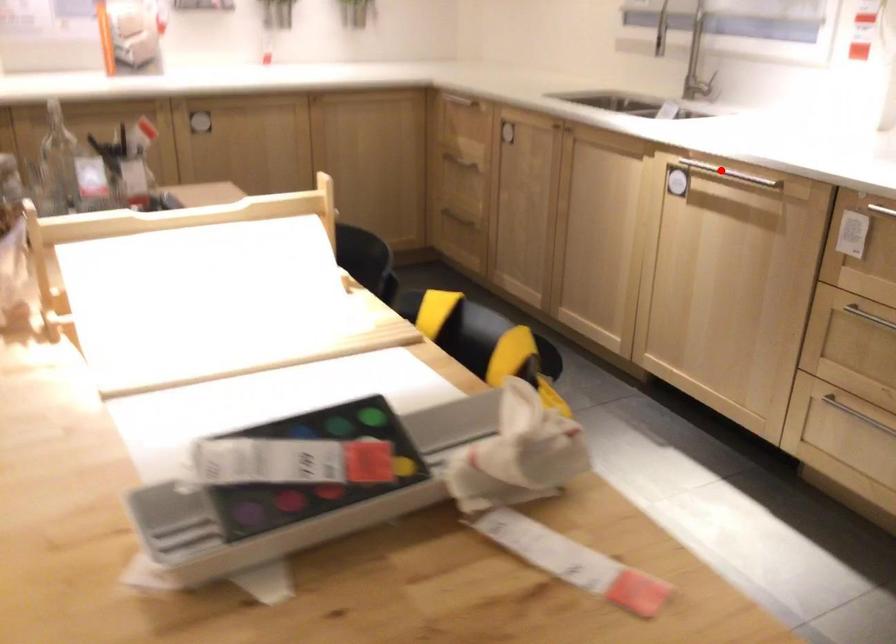
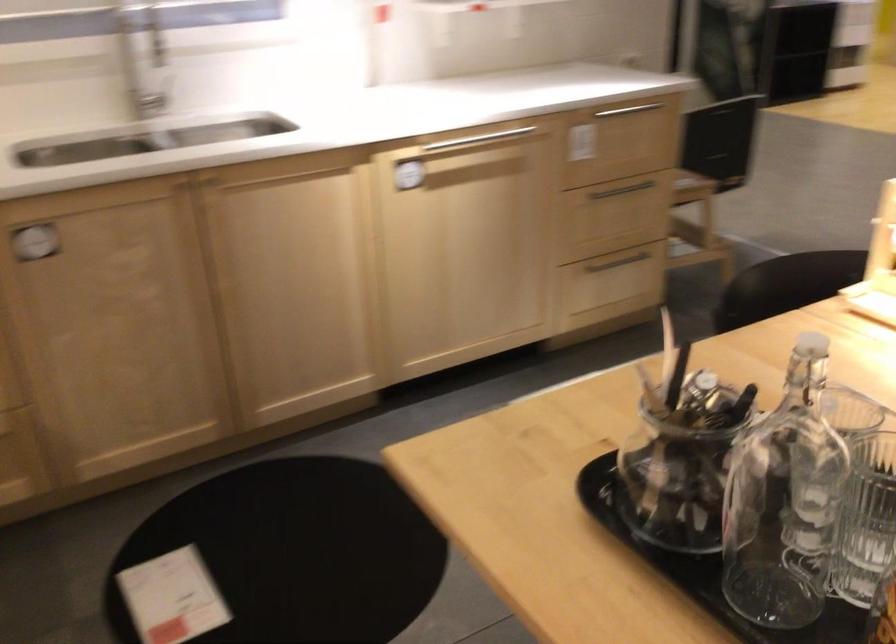
Where in the second image is the point corresponding to the highlighted location from the first image?

(472, 140)